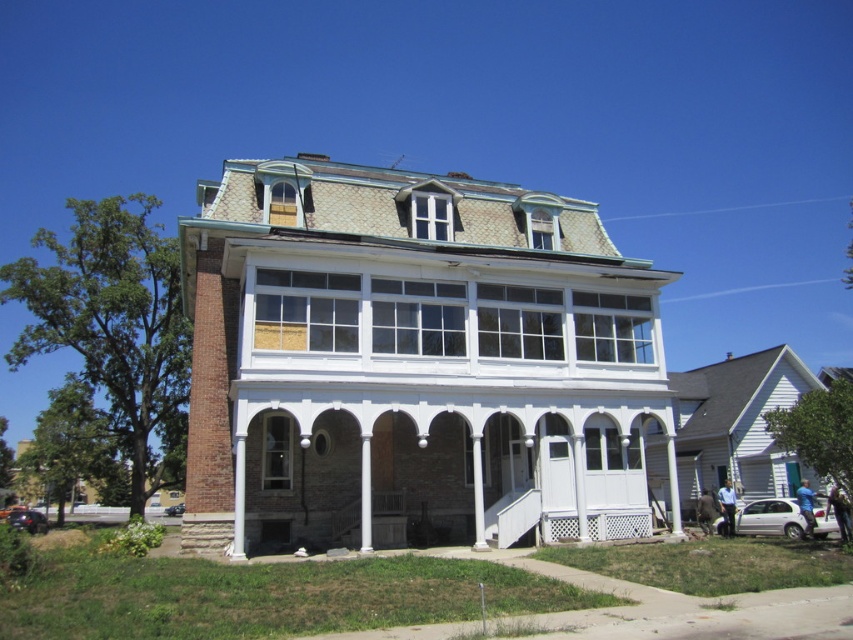
Does white wood porch at center have a smaller size compared to metallic silver sedan at lower left?

No, white wood porch at center is not smaller than metallic silver sedan at lower left.

Can you confirm if white wood porch at center is wider than metallic silver sedan at lower left?

Indeed, white wood porch at center has a greater width compared to metallic silver sedan at lower left.

Where is `white wood porch at center`? white wood porch at center is located at coordinates (438, 419).

Is point (782, 518) less distant than point (15, 509)?

Yes, point (782, 518) is closer to viewer.

Is white matte sedan at lower right positioned at the back of metallic orange car at lower left?

No.

What do you see at coordinates (770, 516) in the screenshot? I see `white matte sedan at lower right` at bounding box center [770, 516].

Identify the location of white matte sedan at lower right. The image size is (853, 640). (770, 516).

Locate an element on the screen. The height and width of the screenshot is (640, 853). metallic orange car at lower left is located at coordinates (28, 520).

Is point (22, 513) farther from camera compared to point (177, 513)?

No, (22, 513) is in front of (177, 513).

This screenshot has height=640, width=853. Find the location of `metallic orange car at lower left`. metallic orange car at lower left is located at coordinates (28, 520).